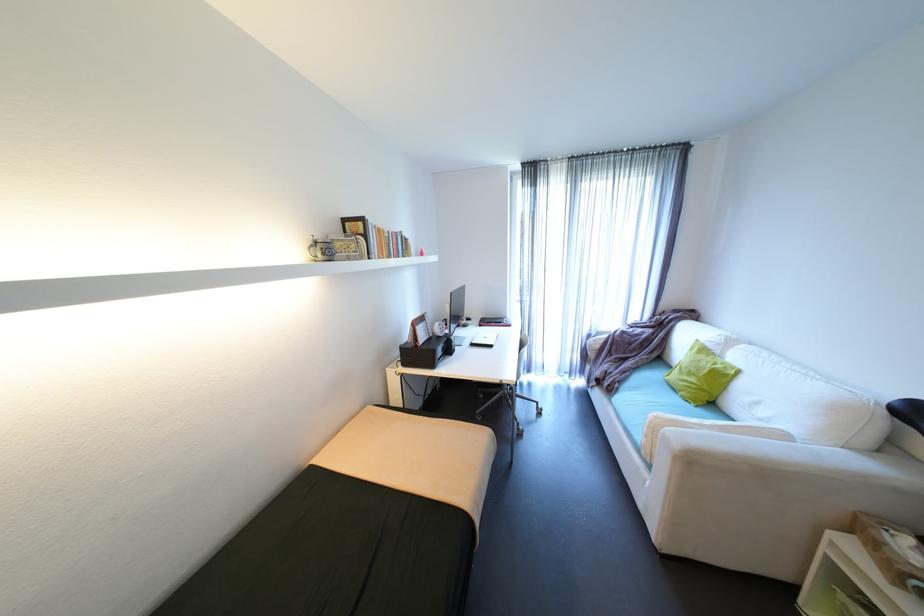
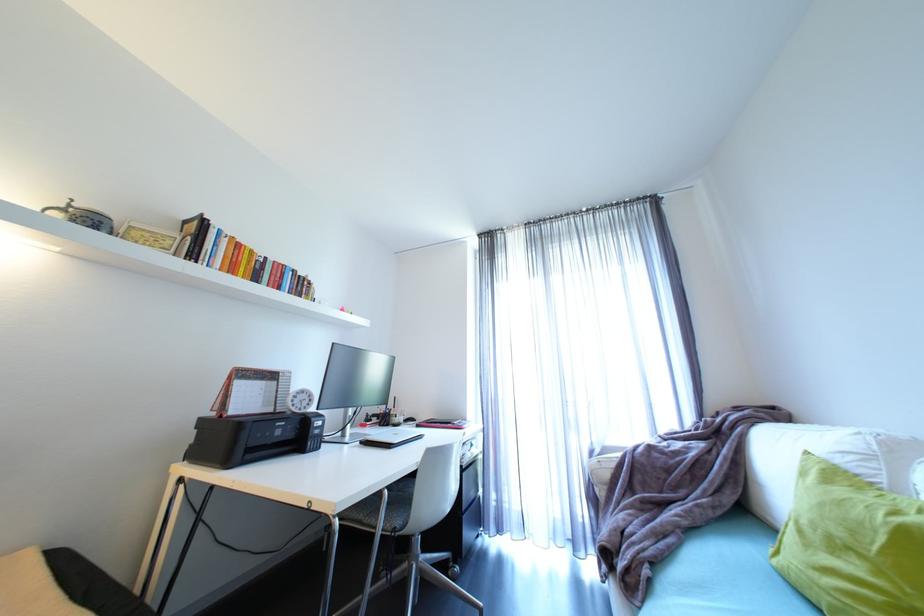
The point at (706, 381) is marked in the first image. Where is the corresponding point in the second image?

(885, 573)